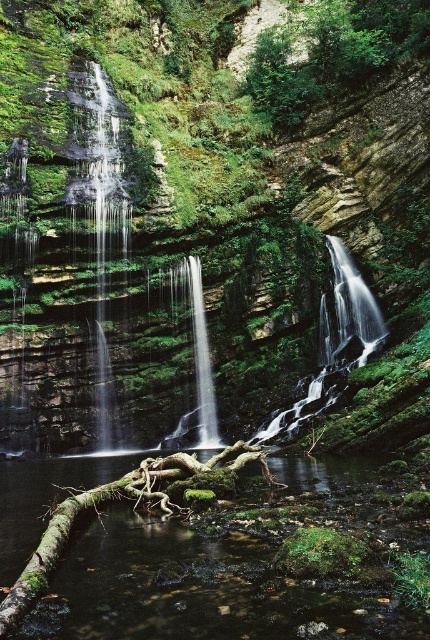
You are a hiker who wants to cross the river at the bottom of the waterfalls. The path you want to take is between the translucent glass waterfall at center and the clear glass waterfall at center. Your backpack has a width of 1.5 feet. Can you safely pass through the gap between them?

The distance between the translucent glass waterfall at center and the clear glass waterfall at center is 20.37 feet, which is much wider than your backpack of 1.5 feet. Therefore, you can safely pass through the gap between them.

Looking at this image, you are standing at the camera position and want to reach the point marked at coordinates [267,531] in the scene. The path you need to take is 36.04 feet long. If you walk at a speed of 3 feet per second, how many seconds will it take you to reach the point?

The point marked at coordinates [267,531] is 36.04 feet away from the camera. At a walking speed of 3 feet per second, it will take 36.04 divided by 3, which is approximately 12.01 seconds to reach the point.

You are standing at the base of the waterfalls and want to reach the point marked as point (332,248). However, there is a point marked as point (196,273) blocking your path. Can you walk around it to reach your destination?

Point (332,248) is behind point (196,273), so you can walk around point (196,273) to reach point (332,248) as long as there is a clear path around it.